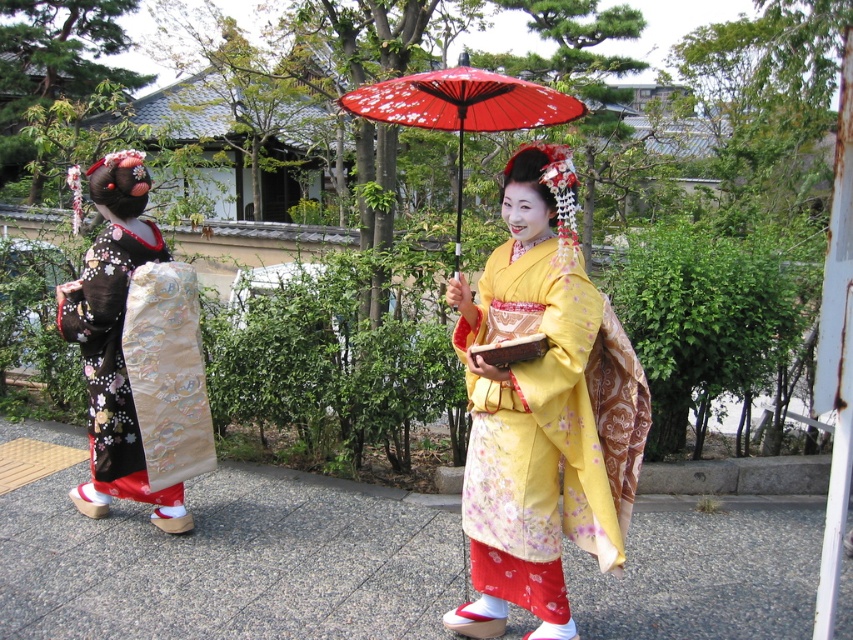
Which of these two, gray concrete pavement at center or yellow silk kimono at center, stands shorter?

gray concrete pavement at center is shorter.

In the scene shown: Is gray concrete pavement at center wider than yellow silk kimono at center?

Yes.

Is point (669, 628) farther from camera compared to point (477, 600)?

That is False.

Identify the location of gray concrete pavement at center. (230, 563).

Is yellow silk kimono at center bigger than black satin kimono at left?

No, yellow silk kimono at center is not bigger than black satin kimono at left.

Does point (596, 500) lie in front of point (178, 484)?

Yes, point (596, 500) is in front of point (178, 484).

Does point (605, 504) come closer to viewer compared to point (144, 465)?

Yes, it is in front of point (144, 465).

Find the location of a particular element. yellow silk kimono at center is located at coordinates (543, 410).

Can you confirm if black satin kimono at left is positioned to the right of red paper parasol at center?

Incorrect, black satin kimono at left is not on the right side of red paper parasol at center.

Between black satin kimono at left and red paper parasol at center, which one appears on the left side from the viewer's perspective?

black satin kimono at left is more to the left.

What do you see at coordinates (115, 342) in the screenshot? This screenshot has width=853, height=640. I see `black satin kimono at left` at bounding box center [115, 342].

At what (x,y) coordinates should I click in order to perform the action: click on black satin kimono at left. Please return your answer as a coordinate pair (x, y). Looking at the image, I should click on (115, 342).